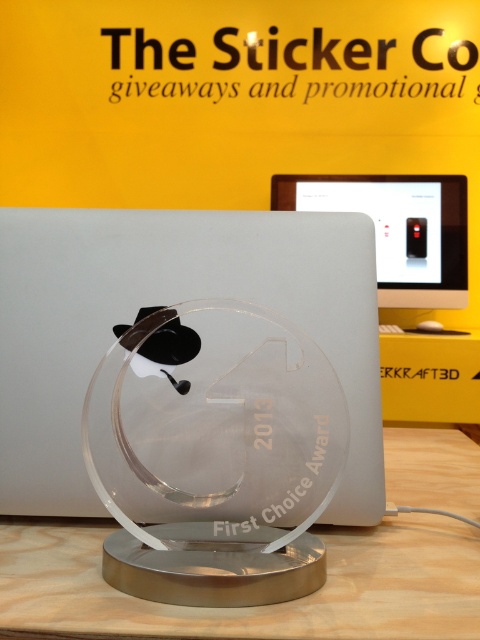
Can you confirm if satin silver laptop at center is positioned below white plastic monitor at center?

Yes.

Measure the distance between satin silver laptop at center and camera.

The distance of satin silver laptop at center from camera is 18.02 inches.

You are a GUI agent. You are given a task and a screenshot of the screen. Output one action in this format:
    pyautogui.click(x=<x>, y=<y>)
    Task: Click on the satin silver laptop at center
    The image size is (480, 640).
    Given the screenshot: What is the action you would take?
    pyautogui.click(x=170, y=301)

Who is taller, clear acrylic table at center or white plastic monitor at center?

white plastic monitor at center

What do you see at coordinates (254, 605) in the screenshot?
I see `clear acrylic table at center` at bounding box center [254, 605].

Does point (109, 637) come closer to viewer compared to point (432, 225)?

Yes.

Locate an element on the screen. clear acrylic table at center is located at coordinates (254, 605).

Can you confirm if clear acrylic table at center is bigger than black plastic mouse at center?

Indeed, clear acrylic table at center has a larger size compared to black plastic mouse at center.

Is clear acrylic table at center above black plastic mouse at center?

No, clear acrylic table at center is not above black plastic mouse at center.

Does point (256, 627) lie behind point (424, 326)?

No, (256, 627) is closer to viewer.

In order to click on clear acrylic table at center in this screenshot , I will do click(x=254, y=605).